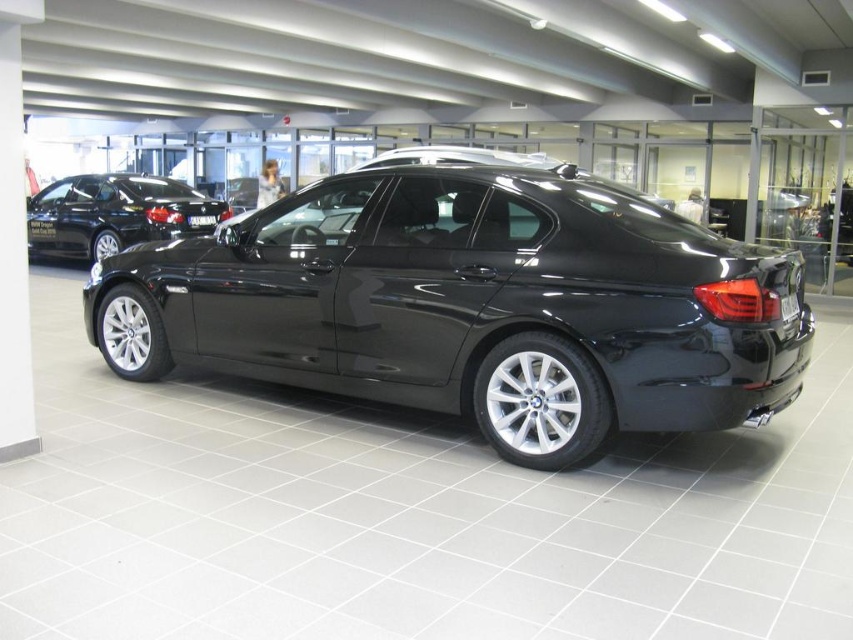
You are a delivery person trying to park a new car in the showroom. The glossy black car at center and the glossy black sedan at upper left are already parked. Which car requires more space in width to park?

The glossy black car at center requires more space in width to park because its width is larger than the glossy black sedan at upper left.

You are a delivery person trying to park a delivery van that is 1.8 meters tall in the showroom. The van must be parked between the glossy black car at center and the glossy black sedan at upper left. Can the van fit vertically between them?

The glossy black car at center is taller than the glossy black sedan at upper left. Since the van is 1.8 meters tall, we need to know the minimum height between the two vehicles. However, the description only states their relative heights, not the actual space between them. Therefore, it is impossible to determine if the van can fit vertically based on the given information.